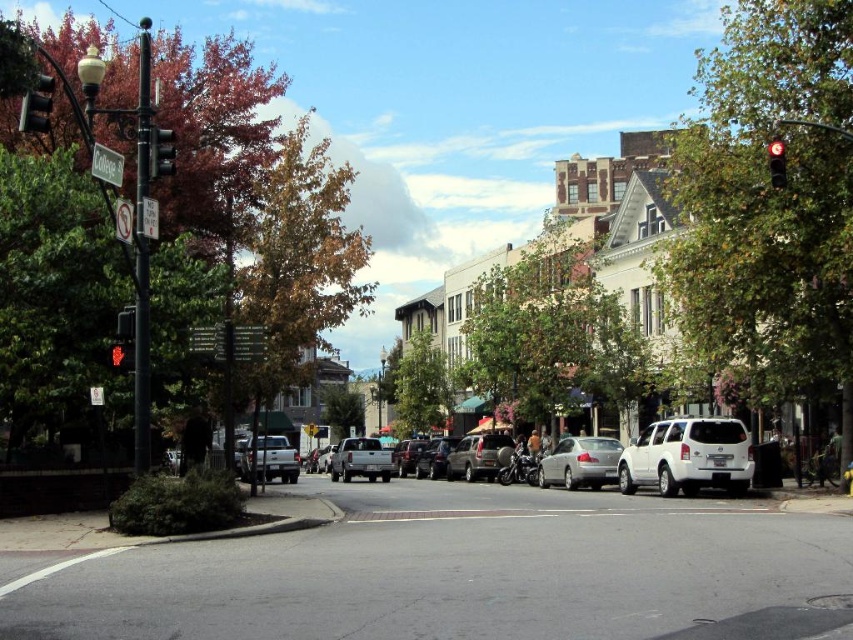
Question: Is silver metallic truck at center smaller than matte gray suv at center?

Choices:
 (A) no
 (B) yes

Answer: (A)

Question: Is metallic traffic light at upper left bigger than matte gray suv at center?

Choices:
 (A) yes
 (B) no

Answer: (B)

Question: Which point is closer to the camera?

Choices:
 (A) (410, 444)
 (B) (241, 458)

Answer: (B)

Question: Which of the following is the farthest from the observer?

Choices:
 (A) satin silver sedan at center
 (B) matte gray suv at center
 (C) red matte traffic light at upper left

Answer: (B)

Question: Does white matte suv at center have a lesser width compared to red glass traffic light at upper right?

Choices:
 (A) no
 (B) yes

Answer: (A)

Question: Considering the real-world distances, which object is farthest from the metallic silver suv at center?

Choices:
 (A) matte silver truck at center
 (B) silver metallic truck at center
 (C) metallic silver truck at center
 (D) satin silver sedan at center

Answer: (C)